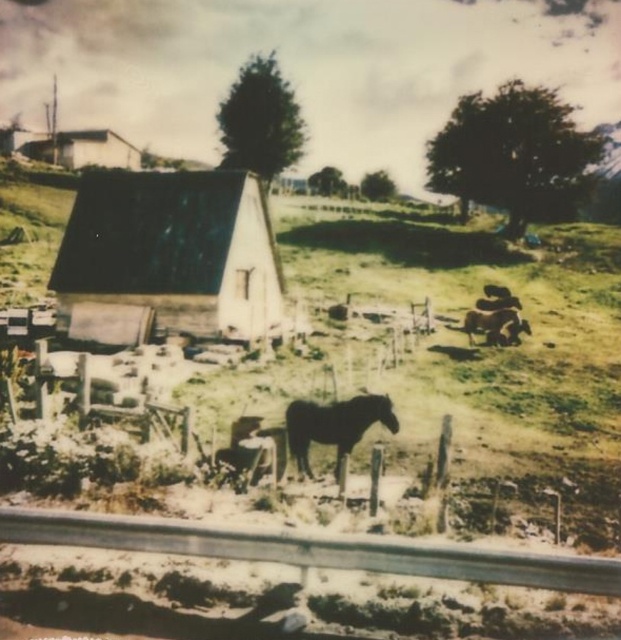
Question: Can you confirm if wooden hut at center is positioned to the right of dark brown horse at center?

Choices:
 (A) yes
 (B) no

Answer: (B)

Question: Where is wooden hut at center located in relation to dark brown horse at center in the image?

Choices:
 (A) below
 (B) above

Answer: (B)

Question: Which of the following is the closest to the observer?

Choices:
 (A) dark brown horse at center
 (B) wooden hut at center

Answer: (A)

Question: Considering the relative positions of wooden hut at center and dark brown horse at center in the image provided, where is wooden hut at center located with respect to dark brown horse at center?

Choices:
 (A) below
 (B) above

Answer: (B)

Question: Which object is farther from the camera taking this photo?

Choices:
 (A) wooden hut at center
 (B) dark brown horse at center

Answer: (A)

Question: Which point is farther to the camera?

Choices:
 (A) (391, 429)
 (B) (245, 234)

Answer: (B)